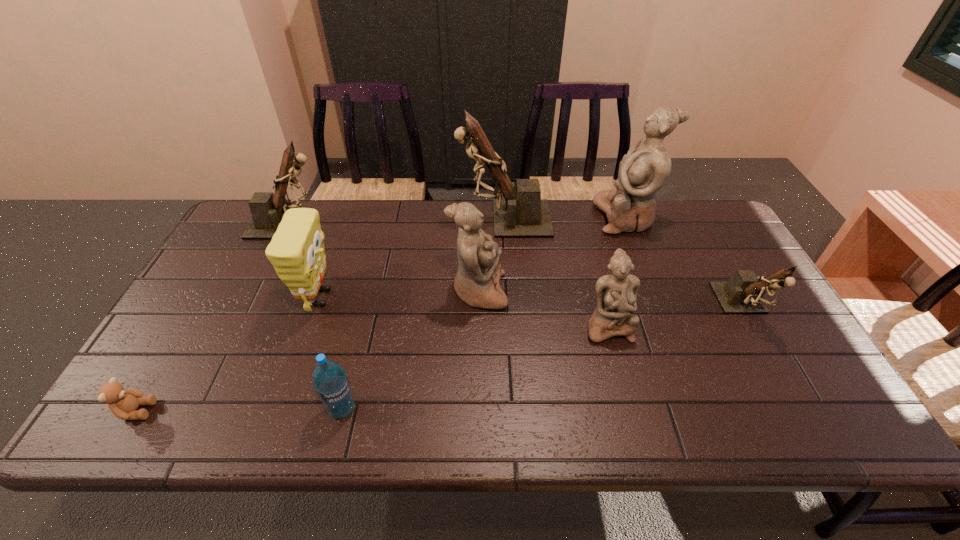
Image resolution: width=960 pixels, height=540 pixels. I want to click on blue water bottle, so click(330, 381).

The image size is (960, 540). Find the location of `teddy bear`. teddy bear is located at coordinates (123, 403).

You are a GUI agent. You are given a task and a screenshot of the screen. Output one action in this format:
    pyautogui.click(x=<x>, y=<y>)
    Task: Click on the brown teddy bear
    This screenshot has width=960, height=540.
    Given the screenshot: What is the action you would take?
    pyautogui.click(x=123, y=403)

Identify the location of vacant space located 0.140m on the front-facing side of the farthest white figurine. The height and width of the screenshot is (540, 960). (554, 218).

This screenshot has width=960, height=540. In order to click on vacant space located on the front-facing side of the farthest white figurine in this screenshot , I will do `click(568, 218)`.

Locate an element on the screen. The image size is (960, 540). vacant space located on the front-facing side of the farthest white figurine is located at coordinates click(x=581, y=218).

Identify the location of vacant space located on the front-facing side of the second brown figurine from left to right. (395, 219).

Find the location of a particular element. vacant space positioned on the front-facing side of the second brown figurine from left to right is located at coordinates (349, 219).

You are a GUI agent. You are given a task and a screenshot of the screen. Output one action in this format:
    pyautogui.click(x=<x>, y=<y>)
    Task: Click on the vacant space positioned on the front-facing side of the second brown figurine from left to right
    This screenshot has height=540, width=960.
    Given the screenshot: What is the action you would take?
    pyautogui.click(x=355, y=219)

Identify the location of vacant space located 0.320m on the front-facing side of the leftmost figurine. (424, 224).